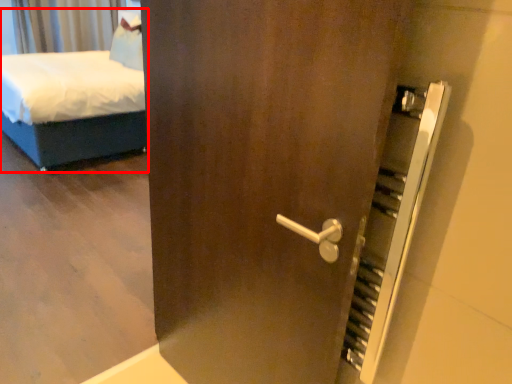
Question: From the image's perspective, where is bed (annotated by the red box) located relative to curtain?

Choices:
 (A) above
 (B) below

Answer: (B)